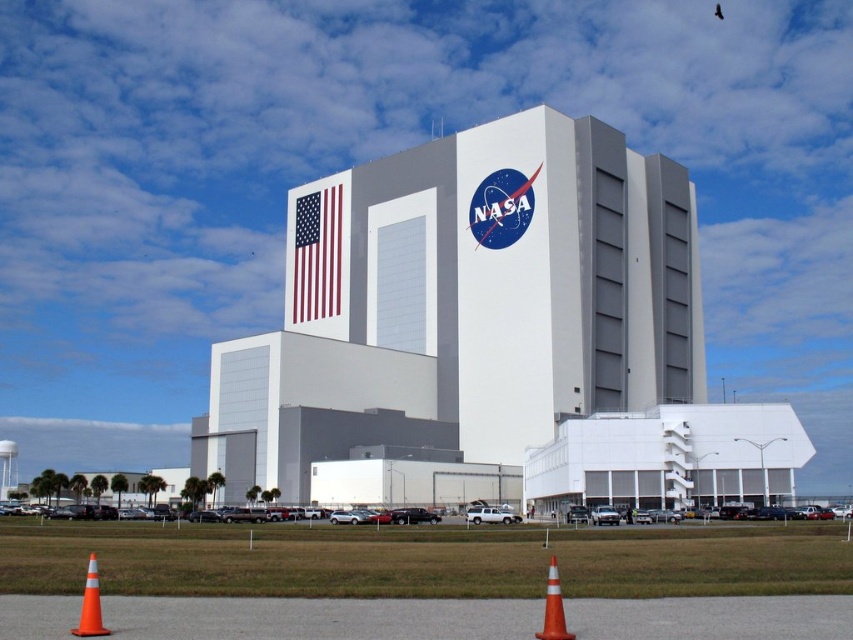
You are standing in front of the NASA Vehicle Assembly Building and see an orange traffic cone. Where exactly is the orange traffic cone at lower center located in relation to the building?

The orange traffic cone at lower center is located at point (x=318, y=618) in relation to the building.

You are a photographer standing in front of the NASA Vehicle Assembly Building. You notice two orange cones on the ground. Which cone, the orange reflective cone at lower left or the orange plastic traffic cone at lower center, is closer to you?

The orange reflective cone at lower left is closer to you because it is further to the viewer than the orange plastic traffic cone at lower center.

You are a photographer standing in front of the NASA Vehicle Assembly Building. You notice an orange traffic cone at lower center and a gray asphalt runway at lower center. Which object is positioned higher from the ground?

The orange traffic cone at lower center is located above the gray asphalt runway at lower center, so it is positioned higher from the ground.